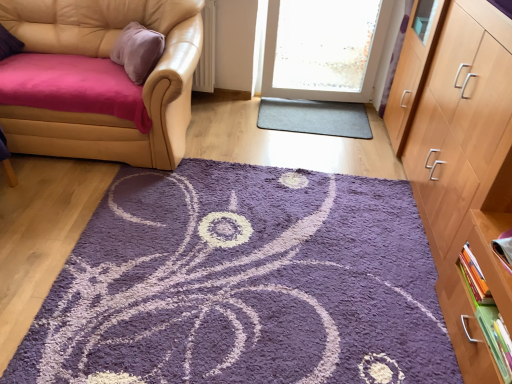
The image size is (512, 384). Describe the element at coordinates (474, 277) in the screenshot. I see `hardcover book at right, which is counted as the second book, starting from the bottom` at that location.

The height and width of the screenshot is (384, 512). Identify the location of light brown wood cabinet at right. (461, 161).

The image size is (512, 384). What do you see at coordinates (314, 117) in the screenshot?
I see `gray rubber mat at center` at bounding box center [314, 117].

Find the location of a particular element. matte purple book at right, positioned as the 3th book in bottom-to-top order is located at coordinates (504, 249).

In the scene shown: Is matte purple book at right, which appears as the first book when viewed from the top, facing away from leather couch at left?

matte purple book at right, which appears as the first book when viewed from the top, does not have its back to leather couch at left.

Does matte purple book at right, which appears as the first book when viewed from the top, lie in front of leather couch at left?

Yes.

From the leather couch at left, count 2nd books forward and point to it. Please provide its 2D coordinates.

[(504, 249)]

Is matte purple book at right, positioned as the 3th book in bottom-to-top order, not within leather couch at left?

matte purple book at right, positioned as the 3th book in bottom-to-top order, is positioned outside leather couch at left.

Considering the relative sizes of hardcover book at right, which is counted as the second book, starting from the bottom, and leather couch at left in the image provided, is hardcover book at right, which is counted as the second book, starting from the bottom, wider than leather couch at left?

Incorrect, the width of hardcover book at right, which is counted as the second book, starting from the bottom, does not surpass that of leather couch at left.

From a real-world perspective, is hardcover book at right, which is counted as the second book, starting from the bottom, located beneath leather couch at left?

Yes, from a real-world perspective, hardcover book at right, which is counted as the second book, starting from the bottom, is below leather couch at left.

Is hardcover book at right, the 2th book positioned from the top, oriented away from leather couch at left?

hardcover book at right, the 2th book positioned from the top, does not have its back to leather couch at left.

How many degrees apart are the facing directions of hardcover book at right, which is counted as the second book, starting from the bottom, and leather couch at left?

There is a 91.6-degree angle between the facing directions of hardcover book at right, which is counted as the second book, starting from the bottom, and leather couch at left.

Looking at this image, in the image, is hardcover book at right, the 2th book positioned from the top, positioned in front of or behind green matte book at lower right, which ranks as the 3th book in top-to-bottom order?

hardcover book at right, the 2th book positioned from the top, is behind green matte book at lower right, which ranks as the 3th book in top-to-bottom order.

Is hardcover book at right, which is counted as the second book, starting from the bottom, positioned with its back to green matte book at lower right, which is counted as the first book, starting from the bottom?

That's not correct — hardcover book at right, which is counted as the second book, starting from the bottom, is not looking away from green matte book at lower right, which is counted as the first book, starting from the bottom.

Consider the image. Do you think hardcover book at right, which is counted as the second book, starting from the bottom, is within green matte book at lower right, which is counted as the first book, starting from the bottom, or outside of it?

hardcover book at right, which is counted as the second book, starting from the bottom, is not inside green matte book at lower right, which is counted as the first book, starting from the bottom, it's outside.

Who is bigger, leather couch at left or matte purple book at right, which appears as the first book when viewed from the top?

leather couch at left.

Is leather couch at left surrounding matte purple book at right, positioned as the 3th book in bottom-to-top order?

No, matte purple book at right, positioned as the 3th book in bottom-to-top order, is not surrounded by leather couch at left.

Does leather couch at left appear on the right side of matte purple book at right, positioned as the 3th book in bottom-to-top order?

Incorrect, leather couch at left is not on the right side of matte purple book at right, positioned as the 3th book in bottom-to-top order.

Does gray rubber mat at center turn towards purple shaggy rug at center?

Yes.

Is gray rubber mat at center to the right of purple shaggy rug at center from the viewer's perspective?

Correct, you'll find gray rubber mat at center to the right of purple shaggy rug at center.

Is gray rubber mat at center inside the boundaries of purple shaggy rug at center, or outside?

gray rubber mat at center is not inside purple shaggy rug at center, it's outside.

How distant is gray rubber mat at center from purple shaggy rug at center?

gray rubber mat at center and purple shaggy rug at center are 3.95 feet apart from each other.

Consider the image. Which point is more forward, [504,249] or [508,219]?

The point [504,249] is more forward.

Based on the photo, from a real-world perspective, is matte purple book at right, positioned as the 3th book in bottom-to-top order, under light brown wood cabinet at right?

Yes.

From the image's perspective, is matte purple book at right, which appears as the first book when viewed from the top, over light brown wood cabinet at right?

Actually, matte purple book at right, which appears as the first book when viewed from the top, appears below light brown wood cabinet at right in the image.

Is the surface of matte purple book at right, which appears as the first book when viewed from the top, in direct contact with light brown wood cabinet at right?

No, matte purple book at right, which appears as the first book when viewed from the top, is not next to light brown wood cabinet at right.

Can you confirm if green matte book at lower right, which is counted as the first book, starting from the bottom, is positioned to the left of light brown wood cabinet at right?

Correct, you'll find green matte book at lower right, which is counted as the first book, starting from the bottom, to the left of light brown wood cabinet at right.

Consider the image. Is green matte book at lower right, which is counted as the first book, starting from the bottom, wider or thinner than light brown wood cabinet at right?

In the image, green matte book at lower right, which is counted as the first book, starting from the bottom, appears to be more narrow than light brown wood cabinet at right.

Could you measure the distance between green matte book at lower right, which ranks as the 3th book in top-to-bottom order, and light brown wood cabinet at right?

green matte book at lower right, which ranks as the 3th book in top-to-bottom order, and light brown wood cabinet at right are 23.22 inches apart from each other.

Is green matte book at lower right, which ranks as the 3th book in top-to-bottom order, behind light brown wood cabinet at right?

Yes.

From a real-world perspective, starting from the leather couch at left, which book is the 1st one below it? Please provide its 2D coordinates.

[(504, 249)]

In order to click on chair behind the hardcover book at right, the 2th book positioned from the top in this screenshot , I will do pos(106,56).

From the image, which object appears to be farther from green matte book at lower right, which ranks as the 3th book in top-to-bottom order, purple shaggy rug at center or light brown wood cabinet at right?

purple shaggy rug at center.

Based on their spatial positions, is purple shaggy rug at center or green matte book at lower right, which ranks as the 3th book in top-to-bottom order, closer to gray rubber mat at center?

Based on the image, purple shaggy rug at center appears to be nearer to gray rubber mat at center.

Looking at the image, which one is located closer to purple shaggy rug at center, matte purple book at right, which appears as the first book when viewed from the top, or green matte book at lower right, which is counted as the first book, starting from the bottom?

Based on the image, green matte book at lower right, which is counted as the first book, starting from the bottom, appears to be nearer to purple shaggy rug at center.

Considering their positions, is gray rubber mat at center positioned closer to light brown wood cabinet at right than matte purple book at right, positioned as the 3th book in bottom-to-top order?

matte purple book at right, positioned as the 3th book in bottom-to-top order, is closer to light brown wood cabinet at right.

Looking at the image, which one is located closer to hardcover book at right, which is counted as the second book, starting from the bottom, purple shaggy rug at center or leather couch at left?

purple shaggy rug at center is closer to hardcover book at right, which is counted as the second book, starting from the bottom.

Looking at the image, which one is located closer to hardcover book at right, which is counted as the second book, starting from the bottom, green matte book at lower right, which is counted as the first book, starting from the bottom, or gray rubber mat at center?

Based on the image, green matte book at lower right, which is counted as the first book, starting from the bottom, appears to be nearer to hardcover book at right, which is counted as the second book, starting from the bottom.

Looking at the image, which one is located further to purple shaggy rug at center, green matte book at lower right, which ranks as the 3th book in top-to-bottom order, or light brown wood cabinet at right?

green matte book at lower right, which ranks as the 3th book in top-to-bottom order, lies further to purple shaggy rug at center than the other object.

Looking at the image, which one is located further to light brown wood cabinet at right, green matte book at lower right, which is counted as the first book, starting from the bottom, or gray rubber mat at center?

The object further to light brown wood cabinet at right is gray rubber mat at center.

The width and height of the screenshot is (512, 384). What are the coordinates of `mat between light brown wood cabinet at right and gray rubber mat at center from front to back` in the screenshot? It's located at (244, 284).

You are a GUI agent. You are given a task and a screenshot of the screen. Output one action in this format:
    pyautogui.click(x=<x>, y=<y>)
    Task: Click on the doormat between leather couch at left and matte purple book at right, positioned as the 3th book in bottom-to-top order, in the horizontal direction
    This screenshot has height=384, width=512.
    Given the screenshot: What is the action you would take?
    pyautogui.click(x=314, y=117)

Where is `mat located between leather couch at left and matte purple book at right, positioned as the 3th book in bottom-to-top order, in the left-right direction`? The height and width of the screenshot is (384, 512). mat located between leather couch at left and matte purple book at right, positioned as the 3th book in bottom-to-top order, in the left-right direction is located at coordinates (244, 284).

This screenshot has height=384, width=512. Find the location of `mat between leather couch at left and green matte book at lower right, which is counted as the first book, starting from the bottom, in the horizontal direction`. mat between leather couch at left and green matte book at lower right, which is counted as the first book, starting from the bottom, in the horizontal direction is located at coordinates (244, 284).